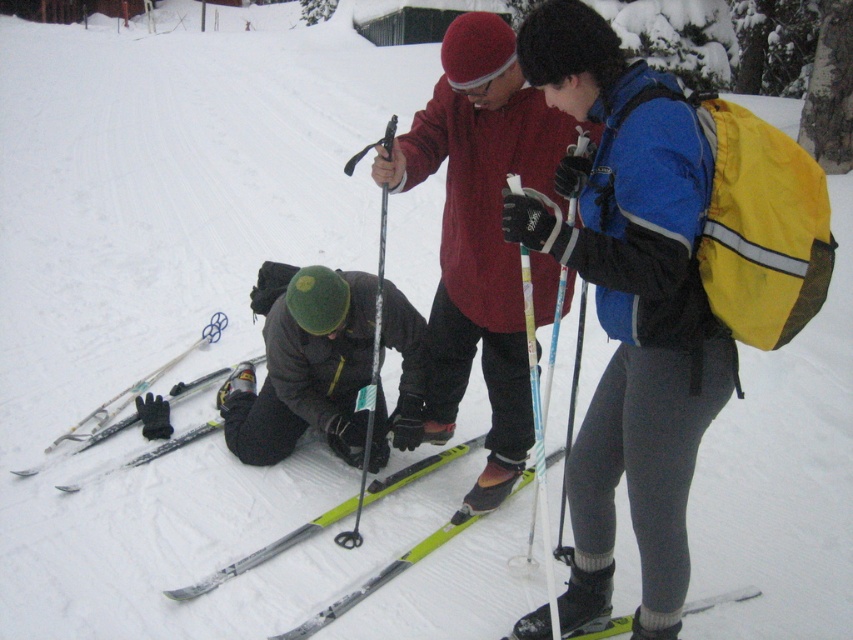
Does silver metallic ski pole at center appear over yellow matte ski at lower center?

Indeed, silver metallic ski pole at center is positioned over yellow matte ski at lower center.

Between point (357, 512) and point (595, 632), which one is positioned in front?

Positioned in front is point (595, 632).

This screenshot has width=853, height=640. What do you see at coordinates (369, 384) in the screenshot? I see `silver metallic ski pole at center` at bounding box center [369, 384].

The image size is (853, 640). Find the location of `silver metallic ski pole at center`. silver metallic ski pole at center is located at coordinates (369, 384).

Is point (335, 506) closer to viewer compared to point (589, 632)?

No, it is not.

Which is above, yellow-green plastic ski at lower center or yellow matte ski at lower center?

Positioned higher is yellow-green plastic ski at lower center.

The width and height of the screenshot is (853, 640). What are the coordinates of `yellow-green plastic ski at lower center` in the screenshot? It's located at (326, 518).

The width and height of the screenshot is (853, 640). Find the location of `yellow-green plastic ski at lower center`. yellow-green plastic ski at lower center is located at coordinates (326, 518).

Does matte red jacket at center have a greater height compared to yellow matte ski at lower center?

Indeed, matte red jacket at center has a greater height compared to yellow matte ski at lower center.

Does matte red jacket at center have a smaller size compared to yellow matte ski at lower center?

Actually, matte red jacket at center might be larger than yellow matte ski at lower center.

Who is more distant from viewer, (438,362) or (581,637)?

Point (438,362)

Locate an element on the screen. The height and width of the screenshot is (640, 853). matte red jacket at center is located at coordinates (479, 234).